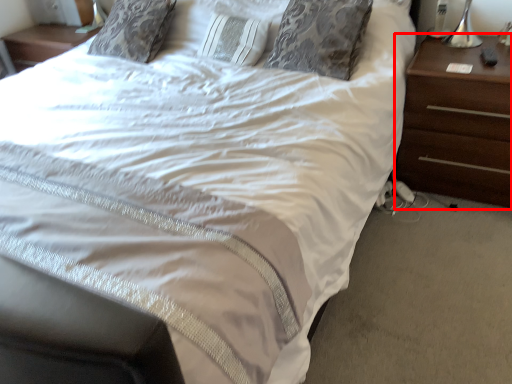
Question: From the image's perspective, what is the correct spatial positioning of nightstand (annotated by the red box) in reference to pillow?

Choices:
 (A) below
 (B) above

Answer: (A)